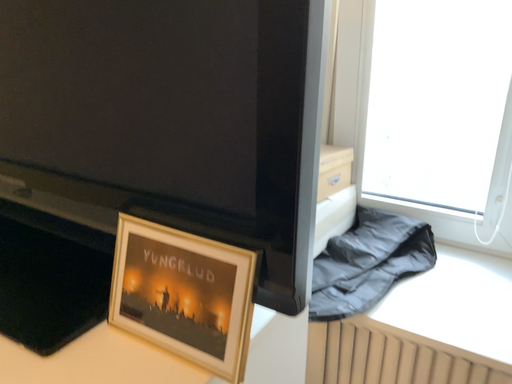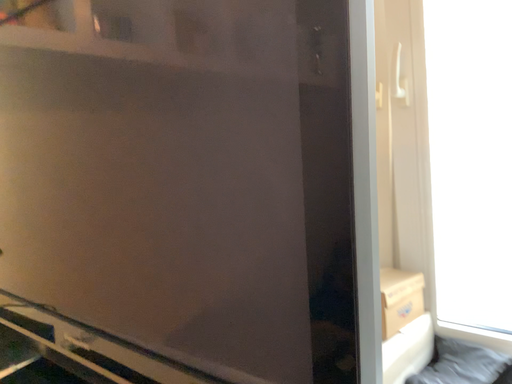
Question: Which way did the camera rotate in the video?

Choices:
 (A) rotated left
 (B) rotated right

Answer: (A)